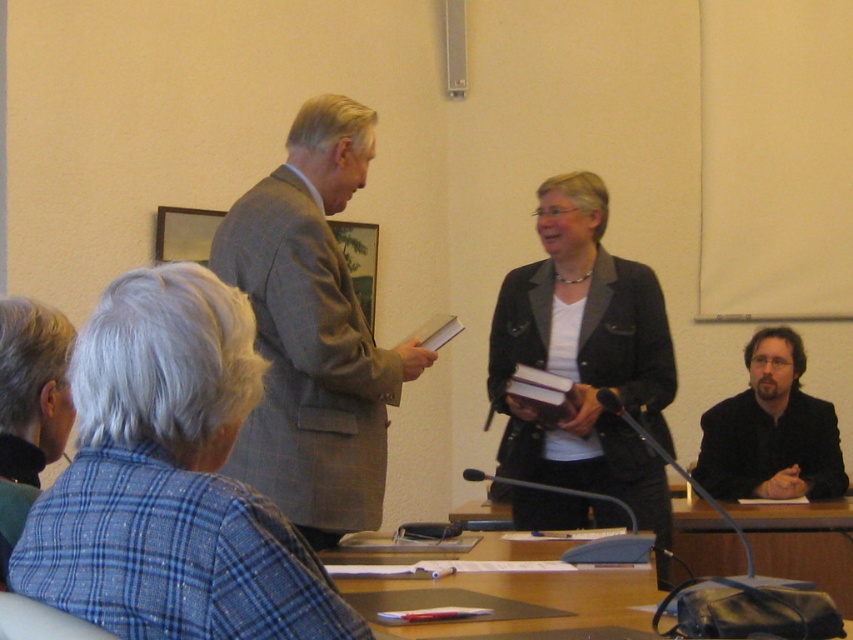
You are a security guard in the conference room and need to check the distance between the dark gray blazer at center and the dark brown suit at lower right. Can you confirm if the distance is more than 30 inches?

The distance between the dark gray blazer at center and the dark brown suit at lower right is 33.16 inches, which is more than 30 inches.